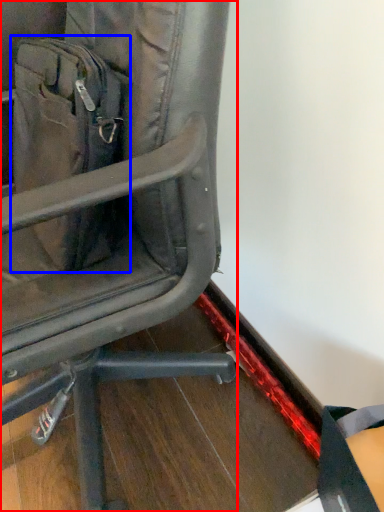
Question: Which point is further to the camera, chair (highlighted by a red box) or messenger bag (highlighted by a blue box)?

Choices:
 (A) chair
 (B) messenger bag

Answer: (B)